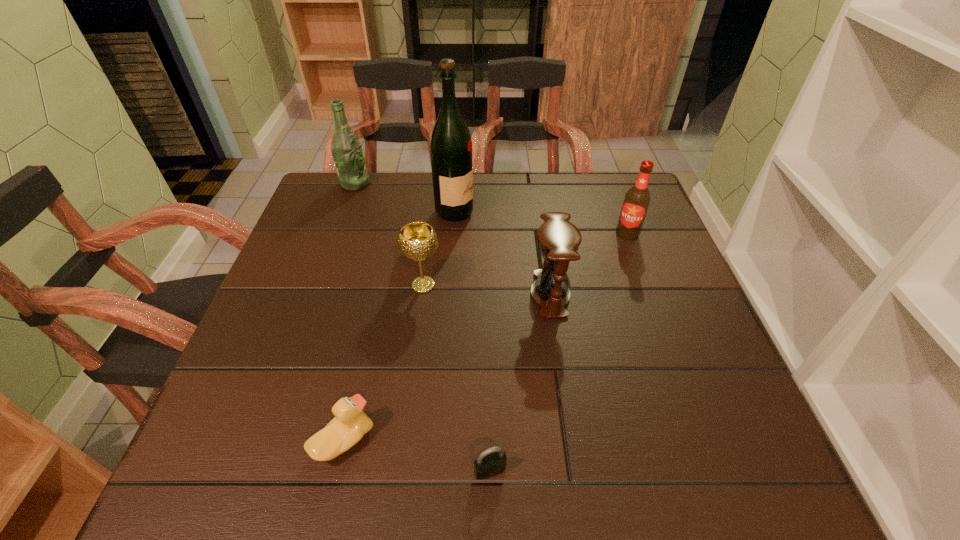
I want to click on beer bottle that is at the far edge, so click(x=346, y=150).

Find the location of a particular element. This screenshot has height=540, width=960. duck located at the near edge is located at coordinates (350, 424).

Find the location of a particular element. The image size is (960, 540). padlock positioned at the near edge is located at coordinates (492, 461).

I want to click on object located at the left edge, so click(x=346, y=150).

Where is `object that is at the right edge`? The width and height of the screenshot is (960, 540). object that is at the right edge is located at coordinates (x=637, y=199).

The image size is (960, 540). Find the location of `object positioned at the far left corner`. object positioned at the far left corner is located at coordinates (346, 150).

At what (x,y) coordinates should I click in order to perform the action: click on vacant space at the far edge of the desktop. Please return your answer as a coordinate pair (x, y). Looking at the image, I should click on (412, 173).

Find the location of a particular element. This screenshot has height=540, width=960. blank space at the near edge of the desktop is located at coordinates (513, 455).

This screenshot has height=540, width=960. I want to click on free region at the left edge of the desktop, so click(x=294, y=386).

I want to click on free space at the right edge of the desktop, so click(650, 325).